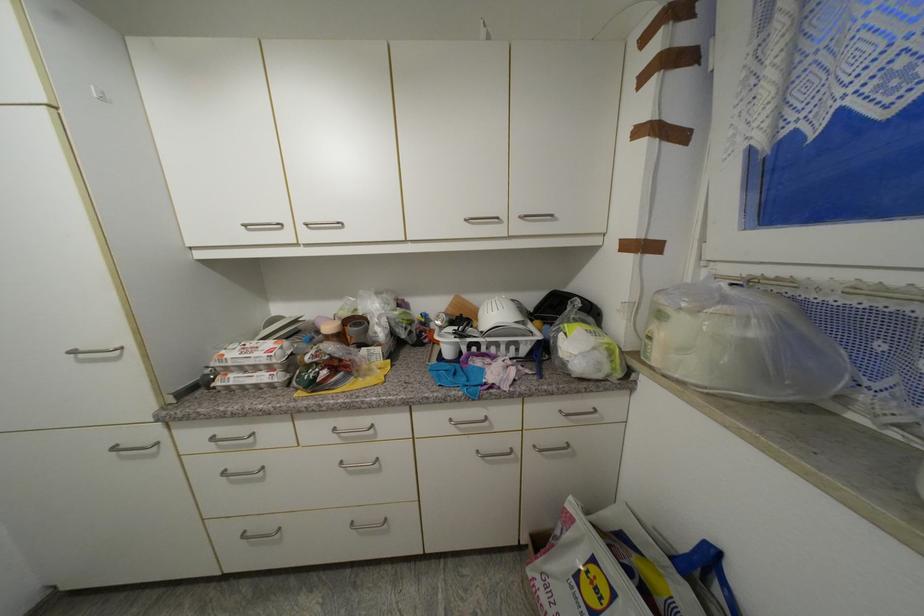
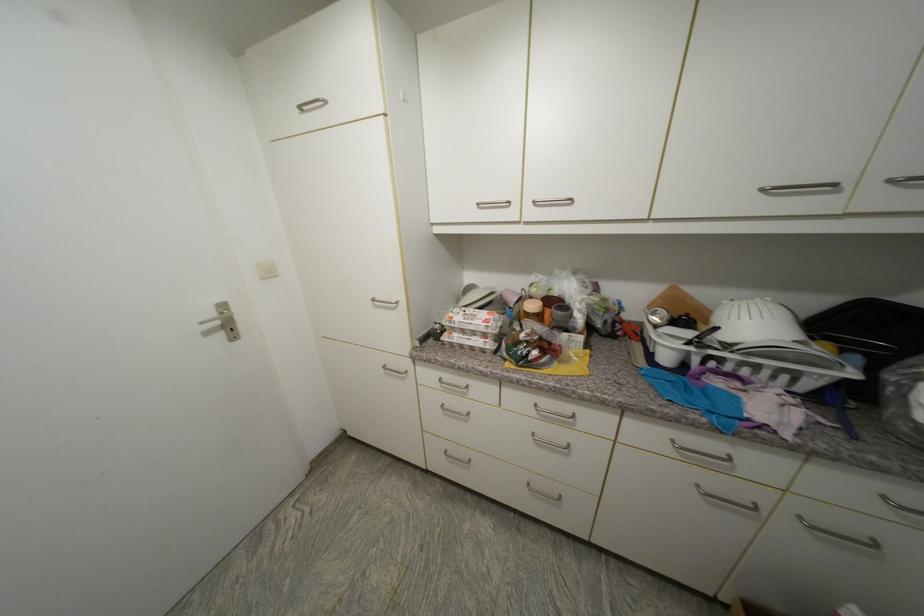
Find the pixel in the second image that matches the point at 79,354 in the first image.

(379, 301)